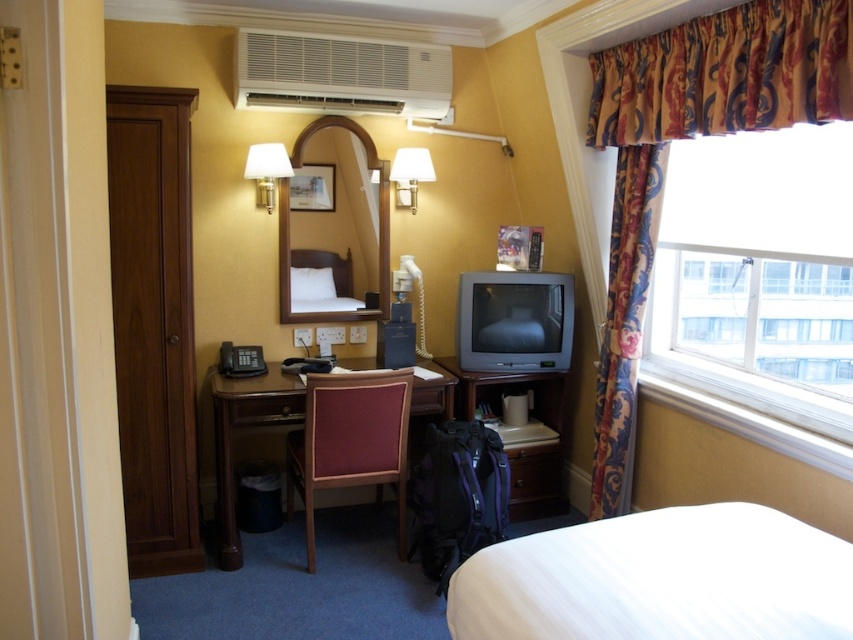
Question: Can you confirm if white plastic air conditioner at upper center is wider than wooden desk at center?

Choices:
 (A) no
 (B) yes

Answer: (B)

Question: Is patterned fabric curtain at upper right positioned at the back of wooden desk at center?

Choices:
 (A) yes
 (B) no

Answer: (B)

Question: Which of the following is the farthest from the observer?

Choices:
 (A) (339, 262)
 (B) (437, 100)

Answer: (A)

Question: Among these points, which one is nearest to the camera?

Choices:
 (A) (440, 65)
 (B) (788, 28)
 (C) (386, 465)
 (D) (447, 621)

Answer: (D)

Question: Among these points, which one is farthest from the camera?

Choices:
 (A) (265, 196)
 (B) (357, 397)
 (C) (396, 150)
 (D) (642, 68)

Answer: (C)

Question: Does white matte wall lamp at upper left lie behind white fabric lampshade at upper center?

Choices:
 (A) no
 (B) yes

Answer: (A)